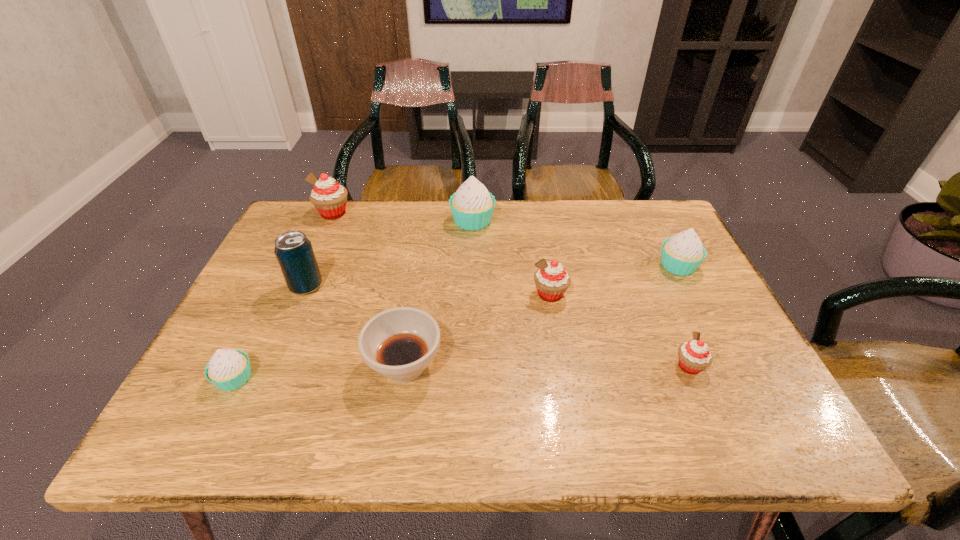
This screenshot has height=540, width=960. I want to click on vacant area that lies between the biggest pink cupcake and the fourth nearest cupcake, so click(506, 239).

You are a GUI agent. You are given a task and a screenshot of the screen. Output one action in this format:
    pyautogui.click(x=<x>, y=<y>)
    Task: Click on the object that is the sixth closest to the nearest white cupcake
    
    Given the screenshot: What is the action you would take?
    pyautogui.click(x=694, y=356)

Point out which object is positioned as the third nearest to the nearest white cupcake. Please provide its 2D coordinates. Your answer should be formatted as a tuple, i.e. [(x, y)], where the tuple contains the x and y coordinates of a point satisfying the conditions above.

[(329, 197)]

At what (x,y) coordinates should I click in order to perform the action: click on cupcake that stands as the closest to the second biggest white cupcake. Please return your answer as a coordinate pair (x, y). This screenshot has width=960, height=540. Looking at the image, I should click on (694, 356).

Find the location of `cupcake that is the fourth closest to the rightmost pink cupcake`. cupcake that is the fourth closest to the rightmost pink cupcake is located at coordinates (228, 369).

In order to click on the second closest pink cupcake to the second biggest pink cupcake in this screenshot , I will do `click(329, 197)`.

What are the coordinates of `the closest pink cupcake to the soup bowl` in the screenshot? It's located at (551, 279).

What are the coordinates of `white cupcake object that ranks as the closest to the second biggest pink cupcake` in the screenshot? It's located at (472, 206).

Identify which white cupcake is the third nearest to the soda can. Please provide its 2D coordinates. Your answer should be formatted as a tuple, i.e. [(x, y)], where the tuple contains the x and y coordinates of a point satisfying the conditions above.

[(683, 253)]

Locate an element on the screen. Image resolution: width=960 pixels, height=540 pixels. vacant region that satisfies the following two spatial constraints: 1. on the front side of the third cupcake from left to right; 2. on the right side of the smallest pink cupcake is located at coordinates (469, 366).